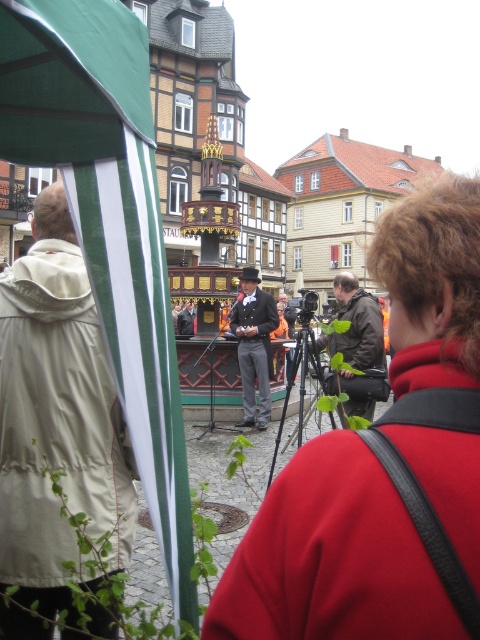
You are a photographer at the event and need to capture a photo that includes both the shiny black suit at center and the brown leather jacket at center. Based on their positions, which one should be positioned on the left side of the photo?

The shiny black suit at center should be positioned on the left side of the photo because it is to the left of the brown leather jacket at center.

You are an event planner observing the scene. You need to seat the person in the shiny black suit at center and the person in the brown leather jacket at center for a group photo. Which one should be placed closer to the camera to ensure both appear equally sized in the photo?

The shiny black suit at center is smaller than the brown leather jacket at center, so to make them appear equally sized in the photo, the shiny black suit at center should be placed closer to the camera.

You are attending a cultural event and see two men in black suits at the center of the stage. One is wearing a shiny black suit at center, and the other is wearing a smooth black suit at center. Which of the two suits is narrower in width?

The shiny black suit at center is thinner than the smooth black suit at center, so the shiny black suit at center is narrower in width.